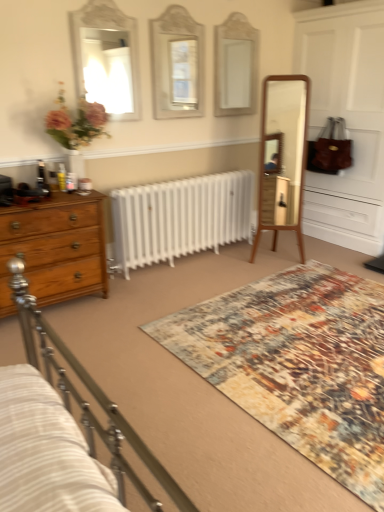
Question: Is multicolored textured rug at center bigger or smaller than matte white mirror at center, acting as the 2th mirror starting from the right?

Choices:
 (A) big
 (B) small

Answer: (A)

Question: Is multicolored textured rug at center in front of or behind matte white mirror at center, acting as the 2th mirror starting from the right, in the image?

Choices:
 (A) behind
 (B) front

Answer: (B)

Question: Which object is positioned farthest from the multicolored textured rug at center?

Choices:
 (A) wooden chest of drawers at left
 (B) matte white mirror at center, the second mirror in the left-to-right sequence
 (C) white glossy mirror at upper left, acting as the third mirror starting from the right
 (D) white glass mirror at upper center, which is the first mirror from right to left

Answer: (D)

Question: Which object is positioned closest to the white glossy mirror at upper left, acting as the third mirror starting from the right?

Choices:
 (A) matte white mirror at center, the second mirror in the left-to-right sequence
 (B) white glass mirror at upper center, arranged as the third mirror when viewed from the left
 (C) wooden chest of drawers at left
 (D) multicolored textured rug at center

Answer: (A)